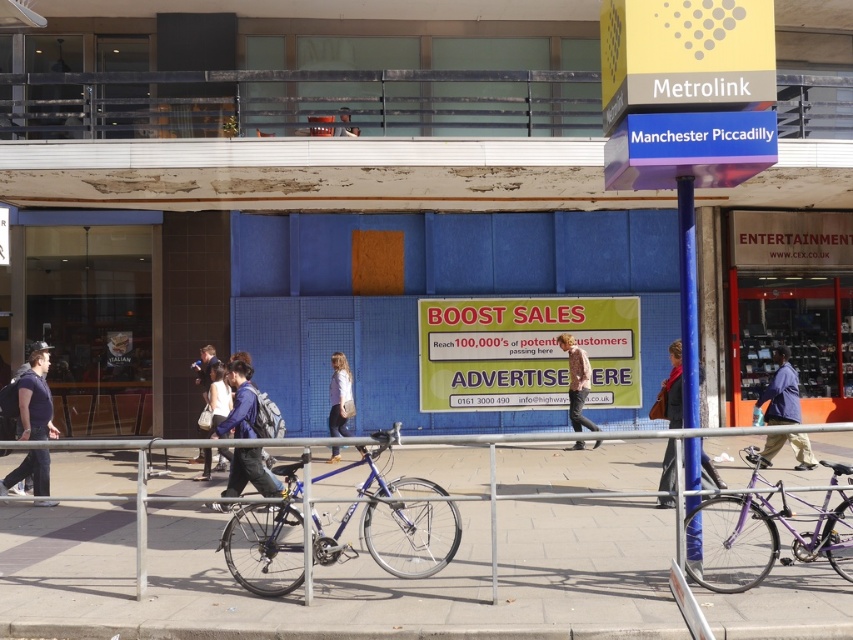
Can you confirm if dark blue jeans at lower left is taller than matte black jacket at center?

Indeed, dark blue jeans at lower left has a greater height compared to matte black jacket at center.

Consider the image. Can you confirm if dark blue jeans at lower left is positioned above matte black jacket at center?

Incorrect, dark blue jeans at lower left is not positioned above matte black jacket at center.

Find the location of a particular element. dark blue jeans at lower left is located at coordinates (35, 397).

Measure the distance between point (387,618) and camera.

The distance of point (387,618) from camera is 23.48 feet.

Who is positioned more to the right, concrete pavement at center or matte blue jacket at center?

From the viewer's perspective, concrete pavement at center appears more on the right side.

Is point (788, 611) more distant than point (247, 356)?

No, (788, 611) is in front of (247, 356).

This screenshot has width=853, height=640. I want to click on concrete pavement at center, so click(369, 561).

Does light brown leather jacket at center have a larger size compared to matte blue jacket at center?

Yes.

Does light brown leather jacket at center appear on the left side of matte blue jacket at center?

Incorrect, light brown leather jacket at center is not on the left side of matte blue jacket at center.

Is point (572, 426) positioned before point (239, 362)?

No, it is not.

Identify the location of light brown leather jacket at center. The height and width of the screenshot is (640, 853). (576, 381).